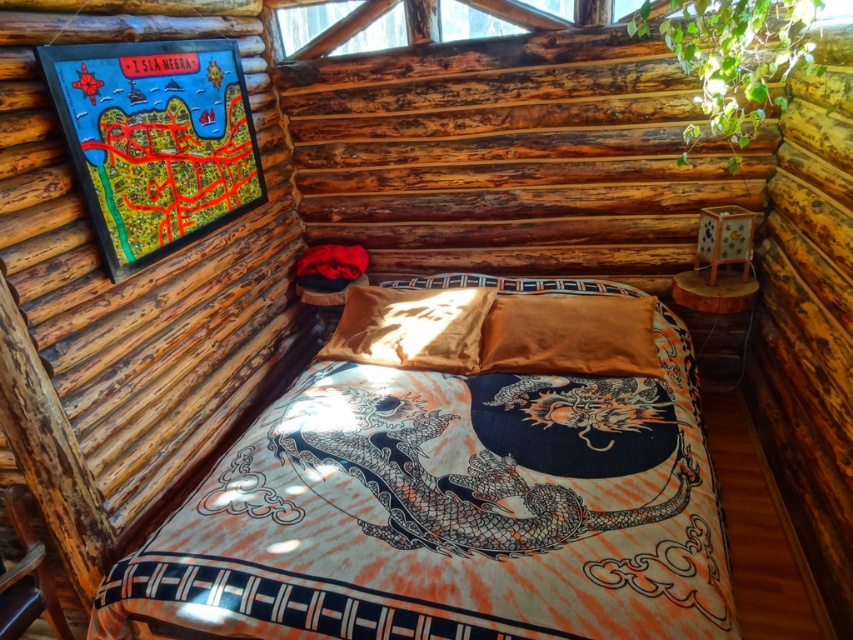
Is satin orange pillow at center below satin gold pillow at center?

No.

Between satin orange pillow at center and satin gold pillow at center, which one appears on the left side from the viewer's perspective?

Positioned to the left is satin gold pillow at center.

Who is more distant from viewer, (497, 364) or (376, 291)?

Positioned behind is point (376, 291).

Locate an element on the screen. This screenshot has height=640, width=853. satin orange pillow at center is located at coordinates (569, 336).

Image resolution: width=853 pixels, height=640 pixels. I want to click on silky cotton bed at center, so click(450, 513).

Does point (524, 477) come closer to viewer compared to point (585, 324)?

Yes.

Image resolution: width=853 pixels, height=640 pixels. In order to click on silky cotton bed at center in this screenshot , I will do `click(450, 513)`.

Can you confirm if silky cotton bed at center is positioned to the left of satin gold pillow at center?

No, silky cotton bed at center is not to the left of satin gold pillow at center.

Can you confirm if silky cotton bed at center is wider than satin gold pillow at center?

Yes.

Where is `silky cotton bed at center`? silky cotton bed at center is located at coordinates (450, 513).